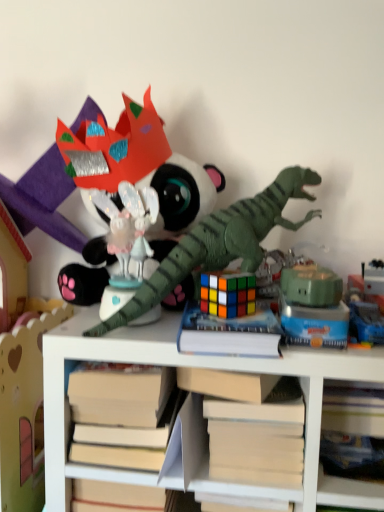
Question: From the image's perspective, is white matte book at center below green matte robot at center, arranged as the 3th toy when viewed from the right?

Choices:
 (A) no
 (B) yes

Answer: (B)

Question: Is white matte book at center oriented towards green matte robot at center, which ranks as the fourth toy in left-to-right order?

Choices:
 (A) yes
 (B) no

Answer: (B)

Question: Does white matte book at center have a greater width compared to green matte robot at center, arranged as the 3th toy when viewed from the right?

Choices:
 (A) yes
 (B) no

Answer: (A)

Question: Is white matte book at center taller than green matte robot at center, which ranks as the fourth toy in left-to-right order?

Choices:
 (A) yes
 (B) no

Answer: (A)

Question: Is white matte book at center positioned with its back to green matte robot at center, arranged as the 3th toy when viewed from the right?

Choices:
 (A) yes
 (B) no

Answer: (B)

Question: Is white matte book at center touching green matte robot at center, arranged as the 3th toy when viewed from the right?

Choices:
 (A) yes
 (B) no

Answer: (B)

Question: Is green matte dinosaur at center, the third toy in the left-to-right sequence, smaller than rubik's cube at center, which appears as the 5th toy when viewed from the right?

Choices:
 (A) no
 (B) yes

Answer: (A)

Question: Is green matte dinosaur at center, the third toy in the left-to-right sequence, not near rubik's cube at center, the 2th toy viewed from the left?

Choices:
 (A) yes
 (B) no

Answer: (B)

Question: Does green matte dinosaur at center, the third toy in the left-to-right sequence, lie in front of rubik's cube at center, the 2th toy viewed from the left?

Choices:
 (A) yes
 (B) no

Answer: (A)

Question: Is the position of green matte dinosaur at center, the third toy in the left-to-right sequence, more distant than that of rubik's cube at center, the 2th toy viewed from the left?

Choices:
 (A) yes
 (B) no

Answer: (B)

Question: From the image's perspective, is green matte dinosaur at center, marked as the 4th toy in a right-to-left arrangement, located beneath rubik's cube at center, which appears as the 5th toy when viewed from the right?

Choices:
 (A) no
 (B) yes

Answer: (A)

Question: From the image's perspective, is green matte dinosaur at center, marked as the 4th toy in a right-to-left arrangement, located above rubik's cube at center, the 2th toy viewed from the left?

Choices:
 (A) yes
 (B) no

Answer: (A)

Question: Is green matte robot at center, arranged as the 3th toy when viewed from the right, smaller than shiny plastic dragon at center, which is the sixth toy in right-to-left order?

Choices:
 (A) yes
 (B) no

Answer: (A)